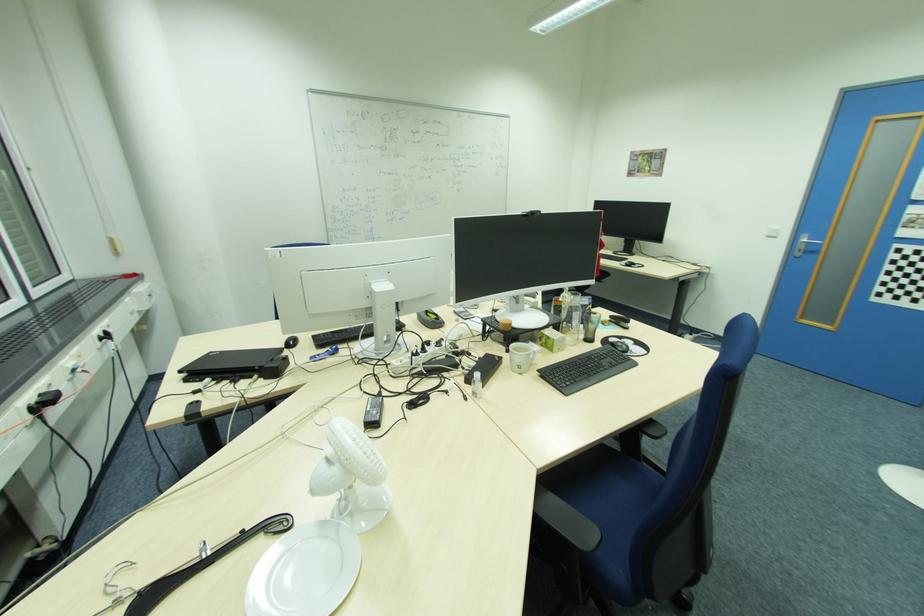
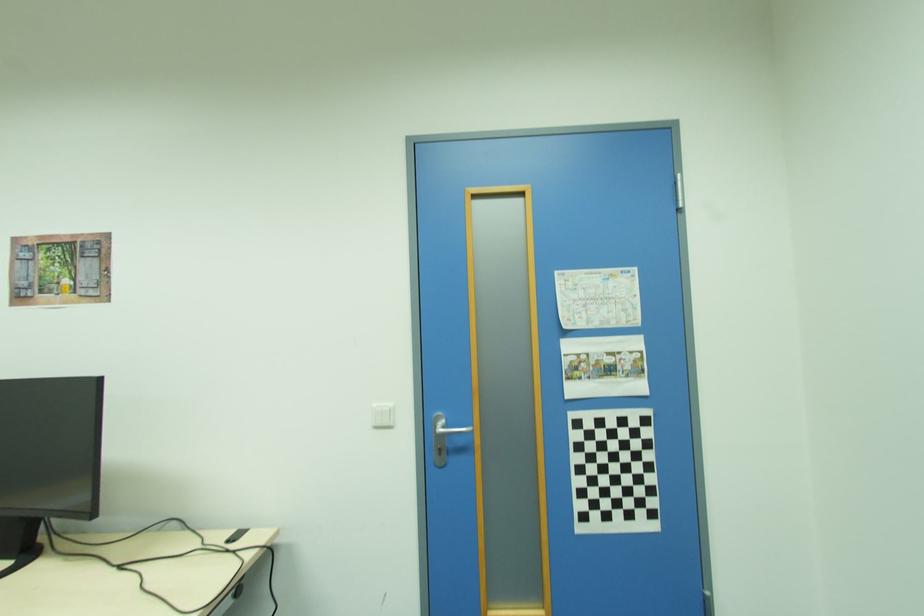
Locate, in the second image, the point that corresponds to (780,238) in the first image.

(394, 427)